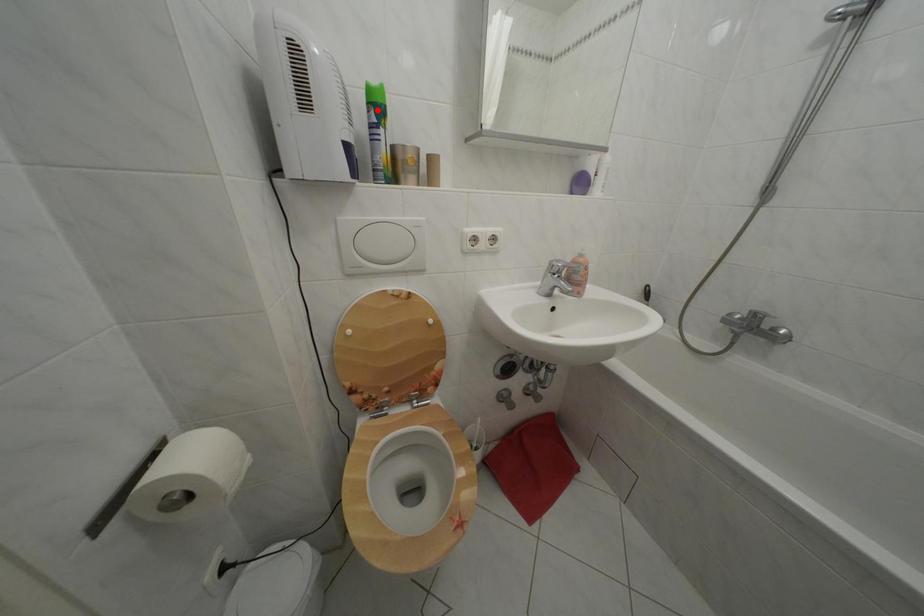
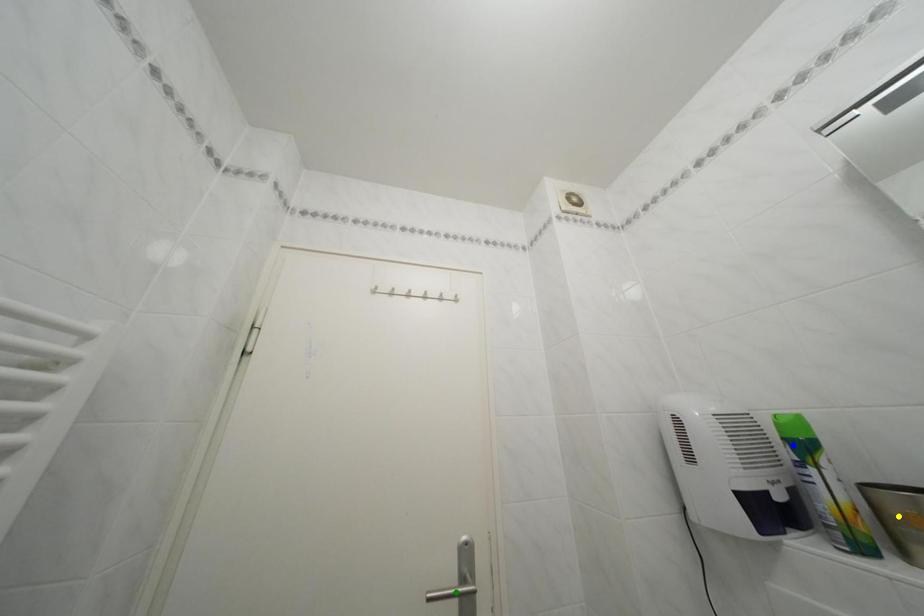
Question: I am providing you with two images of the same scene from different viewpoints. A red point is marked on the first image. You are given multiple points on the second image. Which mark in image 2 goes with the point in image 1?

Choices:
 (A) green point
 (B) blue point
 (C) yellow point

Answer: (B)